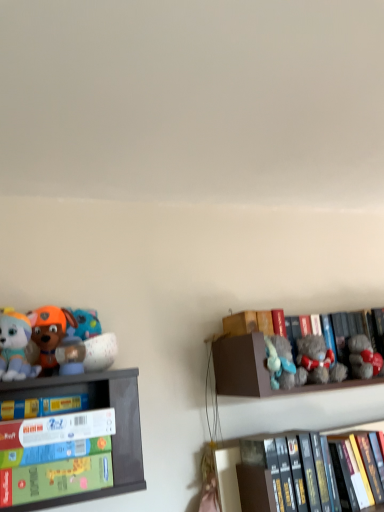
Question: Does brown cardboard box at upper right, the 3th shelf viewed from the left, come behind orange plush dog at left, the 2th toy when ordered from left to right?

Choices:
 (A) yes
 (B) no

Answer: (A)

Question: Does brown cardboard box at upper right, the 3th shelf viewed from the left, have a greater width compared to orange plush dog at left, arranged as the 4th toy when viewed from the right?

Choices:
 (A) no
 (B) yes

Answer: (B)

Question: Is brown cardboard box at upper right, the 3th shelf viewed from the left, not close to orange plush dog at left, the 2th toy when ordered from left to right?

Choices:
 (A) no
 (B) yes

Answer: (A)

Question: Is brown cardboard box at upper right, which appears as the first shelf when viewed from the right, not inside orange plush dog at left, the 2th toy when ordered from left to right?

Choices:
 (A) yes
 (B) no

Answer: (A)

Question: From the image's perspective, is brown cardboard box at upper right, which appears as the first shelf when viewed from the right, on orange plush dog at left, the 2th toy when ordered from left to right?

Choices:
 (A) no
 (B) yes

Answer: (A)

Question: From the image's perspective, relative to soft plush dog at left, the 1th toy in the left-to-right sequence, is brown cardboard box at upper right, which appears as the first shelf when viewed from the right, above or below?

Choices:
 (A) below
 (B) above

Answer: (A)

Question: Considering the positions of point (263, 339) and point (11, 374), is point (263, 339) closer or farther from the camera than point (11, 374)?

Choices:
 (A) closer
 (B) farther

Answer: (B)

Question: Considering the positions of brown cardboard box at upper right, which appears as the first shelf when viewed from the right, and soft plush dog at left, the fifth toy viewed from the right, in the image, is brown cardboard box at upper right, which appears as the first shelf when viewed from the right, wider or thinner than soft plush dog at left, the fifth toy viewed from the right,?

Choices:
 (A) wide
 (B) thin

Answer: (A)

Question: Is brown cardboard box at upper right, which appears as the first shelf when viewed from the right, in front of or behind soft plush dog at left, the fifth toy viewed from the right, in the image?

Choices:
 (A) behind
 (B) front

Answer: (A)

Question: Is soft plush dog at left, the fifth toy viewed from the right, to the left or to the right of gray plush bear at right, which is the 4th toy in left-to-right order, in the image?

Choices:
 (A) left
 (B) right

Answer: (A)

Question: From the image's perspective, is soft plush dog at left, the fifth toy viewed from the right, positioned above or below gray plush bear at right, the second toy viewed from the right?

Choices:
 (A) above
 (B) below

Answer: (A)

Question: From a real-world perspective, is soft plush dog at left, the fifth toy viewed from the right, physically located above or below gray plush bear at right, which is the 4th toy in left-to-right order?

Choices:
 (A) below
 (B) above

Answer: (B)

Question: In the image, is soft plush dog at left, the fifth toy viewed from the right, positioned in front of or behind gray plush bear at right, which is the 4th toy in left-to-right order?

Choices:
 (A) behind
 (B) front

Answer: (B)

Question: From their relative heights in the image, would you say cardboard game box at left, the first shelf in the left-to-right sequence, is taller or shorter than matte white bowl at upper left, the third toy from the left?

Choices:
 (A) short
 (B) tall

Answer: (A)

Question: Is cardboard game box at left, the first shelf in the left-to-right sequence, inside the boundaries of matte white bowl at upper left, the third toy from the left, or outside?

Choices:
 (A) outside
 (B) inside

Answer: (A)